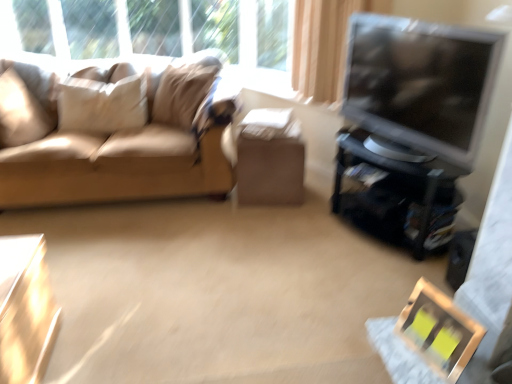
Question: From a real-world perspective, is wooden picture frame at lower right under matte black tv stand at right?

Choices:
 (A) no
 (B) yes

Answer: (B)

Question: Does wooden picture frame at lower right have a greater height compared to matte black tv stand at right?

Choices:
 (A) no
 (B) yes

Answer: (A)

Question: Are wooden picture frame at lower right and matte black tv stand at right located far from each other?

Choices:
 (A) no
 (B) yes

Answer: (A)

Question: Is wooden picture frame at lower right wider than matte black tv stand at right?

Choices:
 (A) no
 (B) yes

Answer: (A)

Question: Can you confirm if wooden picture frame at lower right is thinner than matte black tv stand at right?

Choices:
 (A) no
 (B) yes

Answer: (B)

Question: In the image, is wooden picture frame at lower right positioned in front of or behind suede beige pillow at left, the third pillow positioned from the right?

Choices:
 (A) front
 (B) behind

Answer: (A)

Question: Visually, is wooden picture frame at lower right positioned to the left or to the right of suede beige pillow at left, which is counted as the first pillow, starting from the left?

Choices:
 (A) left
 (B) right

Answer: (B)

Question: Is wooden picture frame at lower right spatially inside suede beige pillow at left, which is counted as the first pillow, starting from the left, or outside of it?

Choices:
 (A) inside
 (B) outside

Answer: (B)

Question: Does point (421, 355) appear closer or farther from the camera than point (7, 120)?

Choices:
 (A) farther
 (B) closer

Answer: (B)

Question: In the image, is matte black tv at right positioned in front of or behind beige fabric pillow at upper left, the second pillow positioned from the left?

Choices:
 (A) front
 (B) behind

Answer: (A)

Question: From the image's perspective, is matte black tv at right positioned above or below beige fabric pillow at upper left, positioned as the second pillow in right-to-left order?

Choices:
 (A) above
 (B) below

Answer: (B)

Question: Is matte black tv at right to the left or to the right of beige fabric pillow at upper left, the second pillow positioned from the left, in the image?

Choices:
 (A) left
 (B) right

Answer: (B)

Question: Looking at their shapes, would you say matte black tv at right is wider or thinner than beige fabric pillow at upper left, positioned as the second pillow in right-to-left order?

Choices:
 (A) thin
 (B) wide

Answer: (B)

Question: Is point (397, 284) closer or farther from the camera than point (98, 91)?

Choices:
 (A) farther
 (B) closer

Answer: (B)

Question: From the image's perspective, relative to beige fabric pillow at upper left, the second pillow positioned from the left, is smooth beige carpet at center above or below?

Choices:
 (A) above
 (B) below

Answer: (B)